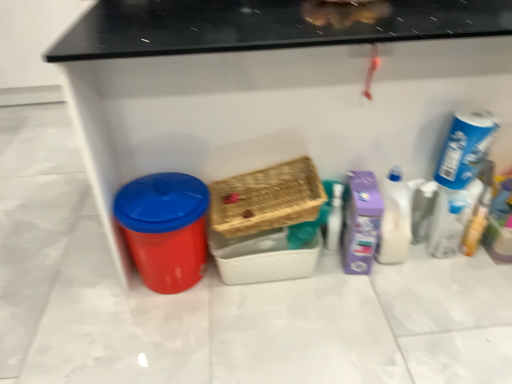
Question: Does woven brown basket at center, the 2th basket when ordered from bottom to top, have a greater width compared to purple cardboard box at right, which is the first cleaning product from left to right?

Choices:
 (A) no
 (B) yes

Answer: (B)

Question: Are woven brown basket at center, the 2th basket when ordered from bottom to top, and purple cardboard box at right, which is the first cleaning product from left to right, far apart?

Choices:
 (A) no
 (B) yes

Answer: (A)

Question: Can you confirm if woven brown basket at center, the 2th basket when ordered from bottom to top, is shorter than purple cardboard box at right, which is the first cleaning product from left to right?

Choices:
 (A) no
 (B) yes

Answer: (B)

Question: Is woven brown basket at center, which appears as the first basket when viewed from the top, positioned behind purple cardboard box at right, acting as the third cleaning product starting from the right?

Choices:
 (A) no
 (B) yes

Answer: (A)

Question: Is woven brown basket at center, the 2th basket when ordered from bottom to top, at the right side of purple cardboard box at right, acting as the third cleaning product starting from the right?

Choices:
 (A) no
 (B) yes

Answer: (A)

Question: Is woven brown basket at center, which appears as the first basket when viewed from the top, in contact with purple cardboard box at right, which is the first cleaning product from left to right?

Choices:
 (A) no
 (B) yes

Answer: (A)

Question: Does woven wood basket at center, arranged as the second basket when viewed from the top, have a larger size compared to purple cardboard box at right, acting as the third cleaning product starting from the right?

Choices:
 (A) yes
 (B) no

Answer: (A)

Question: Is woven wood basket at center, the first basket in the bottom-to-top sequence, facing away from purple cardboard box at right, acting as the third cleaning product starting from the right?

Choices:
 (A) no
 (B) yes

Answer: (A)

Question: From a real-world perspective, is woven wood basket at center, arranged as the second basket when viewed from the top, under purple cardboard box at right, acting as the third cleaning product starting from the right?

Choices:
 (A) no
 (B) yes

Answer: (B)

Question: Is woven wood basket at center, the first basket in the bottom-to-top sequence, not near purple cardboard box at right, acting as the third cleaning product starting from the right?

Choices:
 (A) no
 (B) yes

Answer: (A)

Question: From a real-world perspective, is woven wood basket at center, arranged as the second basket when viewed from the top, physically above purple cardboard box at right, which is the first cleaning product from left to right?

Choices:
 (A) yes
 (B) no

Answer: (B)

Question: Is purple cardboard box at right, acting as the third cleaning product starting from the right, located within woven wood basket at center, arranged as the second basket when viewed from the top?

Choices:
 (A) yes
 (B) no

Answer: (B)

Question: Does woven wood basket at center, the first basket in the bottom-to-top sequence, lie in front of blue cardboard box at upper right, the 1th cleaning product viewed from the right?

Choices:
 (A) yes
 (B) no

Answer: (B)